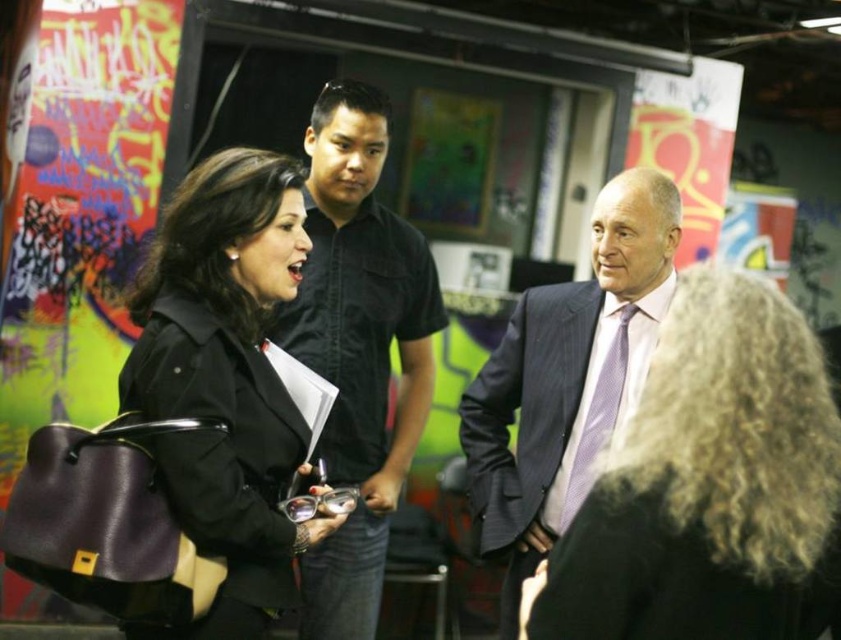
Question: Which of these objects is positioned farthest from the matte black jacket at center?

Choices:
 (A) curly blonde hair at center
 (B) black cotton shirt at center
 (C) dark blue suit at center
 (D) purple textured tie at center

Answer: (D)

Question: Is curly blonde hair at center to the left of matte black jacket at center from the viewer's perspective?

Choices:
 (A) yes
 (B) no

Answer: (B)

Question: Which object is the farthest from the dark blue suit at center?

Choices:
 (A) purple textured tie at center
 (B) matte black jacket at center
 (C) curly blonde hair at center
 (D) black cotton shirt at center

Answer: (C)

Question: Can you confirm if black cotton shirt at center is bigger than dark blue suit at center?

Choices:
 (A) yes
 (B) no

Answer: (A)

Question: Among these points, which one is nearest to the camera?

Choices:
 (A) (564, 508)
 (B) (606, 285)

Answer: (B)

Question: Is curly blonde hair at center bigger than black cotton shirt at center?

Choices:
 (A) yes
 (B) no

Answer: (B)